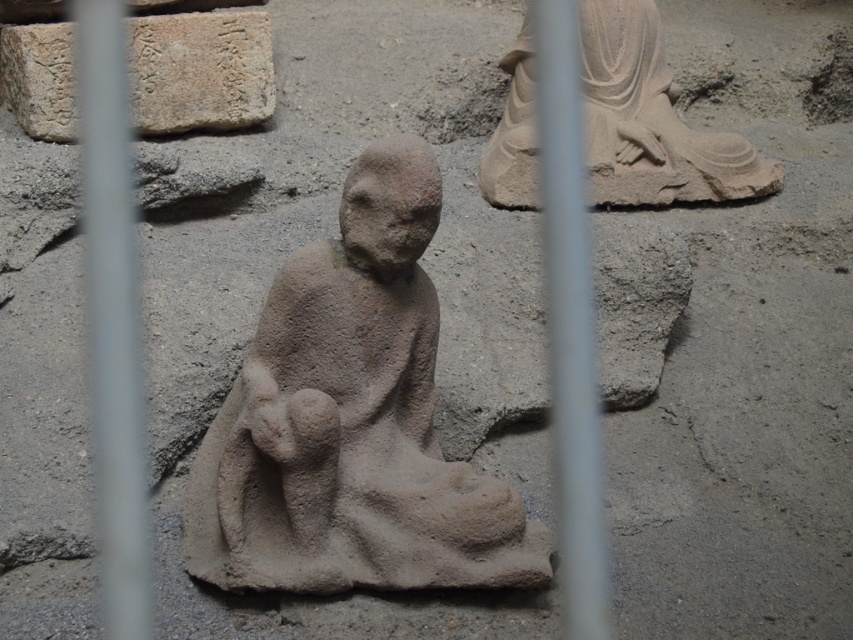
Question: Does gray stone statue at center have a smaller size compared to smooth stone statue at upper right?

Choices:
 (A) yes
 (B) no

Answer: (B)

Question: Which object is farther from the camera taking this photo?

Choices:
 (A) gray stone plaque at upper left
 (B) gray stone statue at center
 (C) smooth stone statue at upper right

Answer: (C)

Question: In this image, where is smooth stone statue at upper right located relative to gray stone plaque at upper left?

Choices:
 (A) above
 (B) below

Answer: (B)

Question: Which point is farther to the camera?

Choices:
 (A) (408, 244)
 (B) (181, 65)

Answer: (B)

Question: Can you confirm if smooth stone statue at upper right is thinner than gray stone plaque at upper left?

Choices:
 (A) no
 (B) yes

Answer: (A)

Question: Which point is closer to the camera?

Choices:
 (A) (276, 339)
 (B) (12, 60)

Answer: (A)